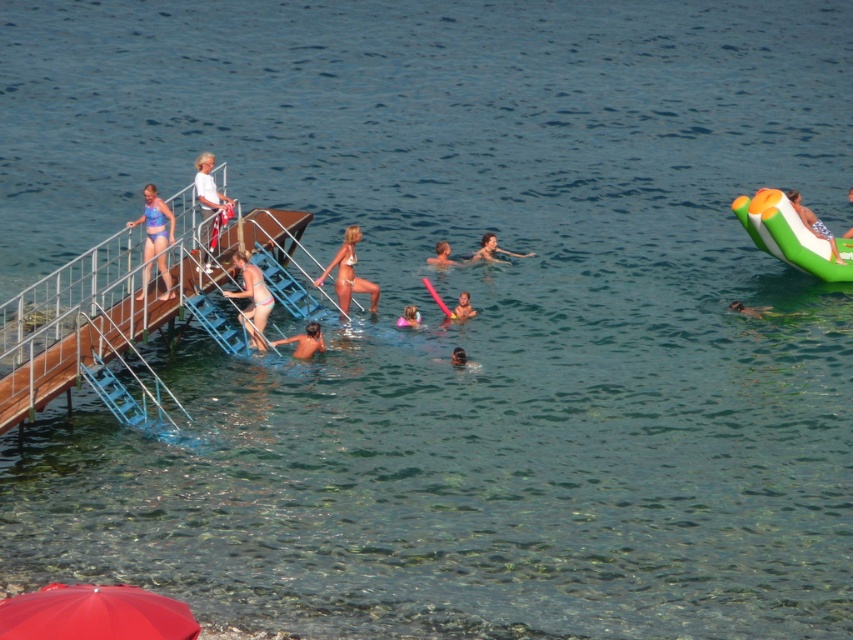
You are planning to place a new float in the water near the smooth brown hair at center and the smooth green float at upper right. Based on their widths, which one can you place closer to the edge of the water without overlapping?

The smooth brown hair at center has a smaller width than the smooth green float at upper right, so it can be placed closer to the edge without overlapping.

You are standing on the metallic silver dock at upper left and want to wave to the smooth skin woman at upper center. Since the dock is closer to you, will you need to look up or down to see her?

A: The metallic silver dock at upper left is closer to the viewer than smooth skin woman at upper center, so you would need to look up to see her because she is further away and higher in the scene.

You are a photographer positioned at the center of the wooden pier. You want to take a photo that includes both the white matte shirt at upper left and the smooth green float at upper right. Based on their positions, which object should you adjust your camera angle upwards to capture?

You should adjust your camera angle upwards to capture the smooth green float at upper right because the white matte shirt at upper left has a lesser height compared to it.